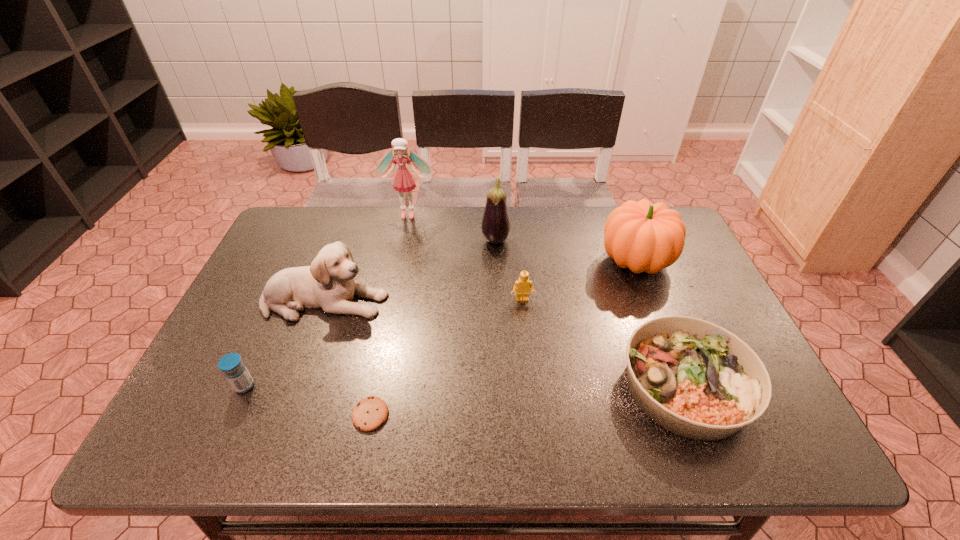
You are a GUI agent. You are given a task and a screenshot of the screen. Output one action in this format:
    pyautogui.click(x=<x>, y=<y>)
    Task: Click on the free spot between the shortest object and the salad plate
    
    Given the screenshot: What is the action you would take?
    pyautogui.click(x=528, y=401)

Locate an element on the screen. This screenshot has height=540, width=960. free space between the medicine and the shortest object is located at coordinates (307, 401).

In order to click on empty space that is in between the tallest object and the salad plate in this screenshot , I will do `click(547, 300)`.

Find the location of a particular element. This screenshot has height=540, width=960. vacant point located between the medicine and the puppy is located at coordinates (285, 343).

The image size is (960, 540). Find the location of `object that can be found as the sixth closest to the salad plate`. object that can be found as the sixth closest to the salad plate is located at coordinates (403, 181).

Image resolution: width=960 pixels, height=540 pixels. Identify the location of object that is the closest one to the Lego. (495, 226).

The image size is (960, 540). In order to click on vacant space that satisfies the following two spatial constraints: 1. on the front-facing side of the farthest object; 2. on the right side of the eggplant in this screenshot , I will do click(402, 242).

Locate an element on the screen. The height and width of the screenshot is (540, 960). free region that satisfies the following two spatial constraints: 1. on the front-facing side of the eggplant; 2. on the left side of the farthest object is located at coordinates (402, 242).

This screenshot has width=960, height=540. Find the location of `free space in the image that satisfies the following two spatial constraints: 1. on the front-facing side of the eggplant; 2. on the left side of the doll`. free space in the image that satisfies the following two spatial constraints: 1. on the front-facing side of the eggplant; 2. on the left side of the doll is located at coordinates (402, 242).

Identify the location of free space in the image that satisfies the following two spatial constraints: 1. on the face of the Lego; 2. on the left side of the salad plate. (x=531, y=386).